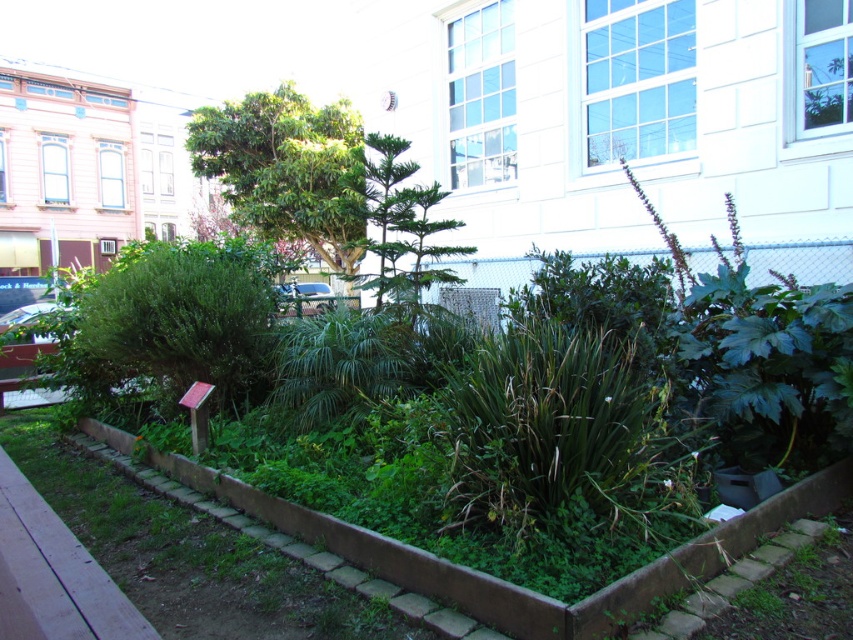
Question: Is green leafy bush at center-left above green leafy tree at center?

Choices:
 (A) no
 (B) yes

Answer: (A)

Question: Considering the real-world distances, which object is farthest from the green leafy plant at center?

Choices:
 (A) green leafy bush at center-left
 (B) green leafy tree at center

Answer: (B)

Question: Which point is closer to the camera taking this photo?

Choices:
 (A) (177, 460)
 (B) (178, 381)

Answer: (A)

Question: Does green leafy plant at center have a greater width compared to green leafy bush at center-left?

Choices:
 (A) no
 (B) yes

Answer: (B)

Question: Does green leafy plant at center appear over green leafy tree at center?

Choices:
 (A) yes
 (B) no

Answer: (B)

Question: Estimate the real-world distances between objects in this image. Which object is farther from the green leafy tree at center?

Choices:
 (A) green leafy bush at center-left
 (B) green leafy plant at center

Answer: (B)